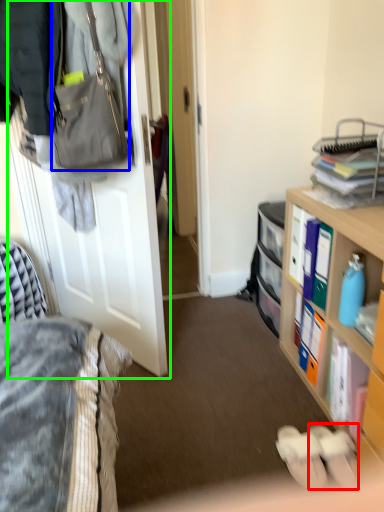
Question: Which is nearer to the footwear (highlighted by a red box)? handbag (highlighted by a blue box) or door (highlighted by a green box).

Choices:
 (A) handbag
 (B) door

Answer: (B)